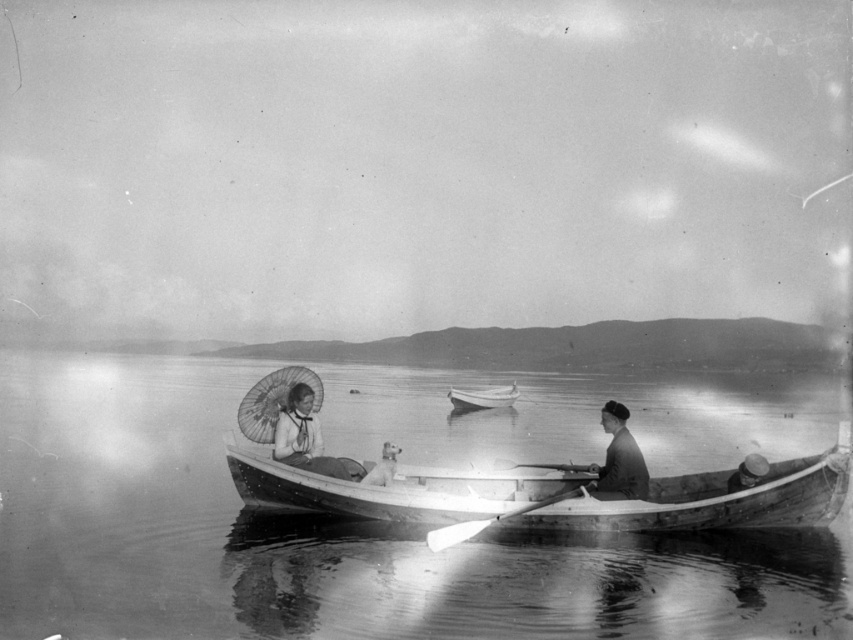
You are standing on the lakeside dock and see the clear water at boat center and the smooth fur dog at center. Which object is higher in the image?

The smooth fur dog at center is higher than the clear water at boat center because the clear water at boat center is located below smooth fur dog at center.

What is the exact coordinate of the smooth silk parasol at center?

The smooth silk parasol at center is located at point (306,438).